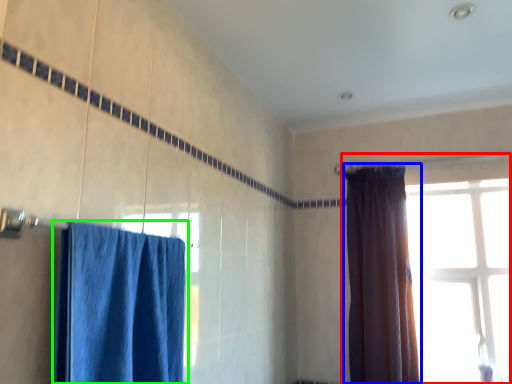
Question: Which is farther away from window (highlighted by a red box)? curtain (highlighted by a blue box) or curtain (highlighted by a green box)?

Choices:
 (A) curtain
 (B) curtain

Answer: (B)